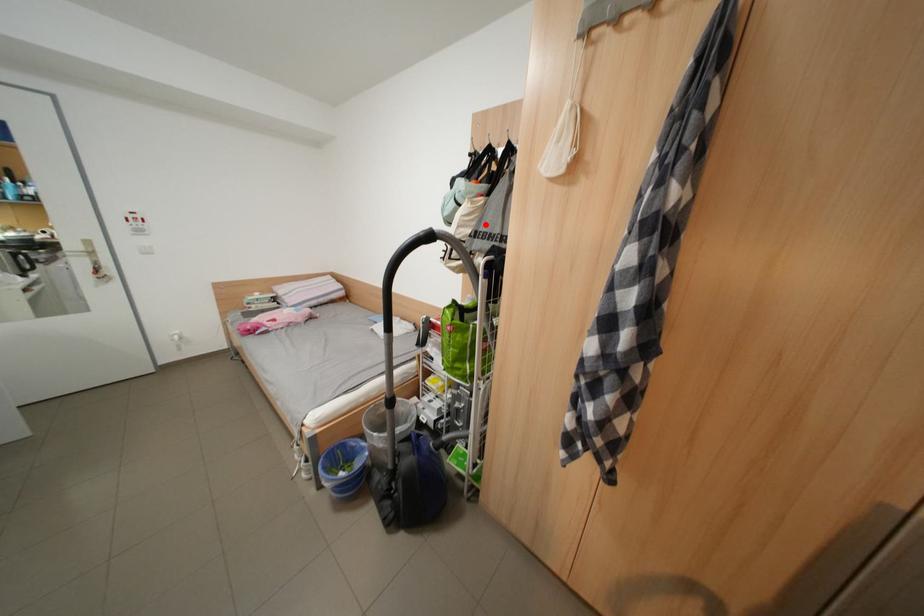
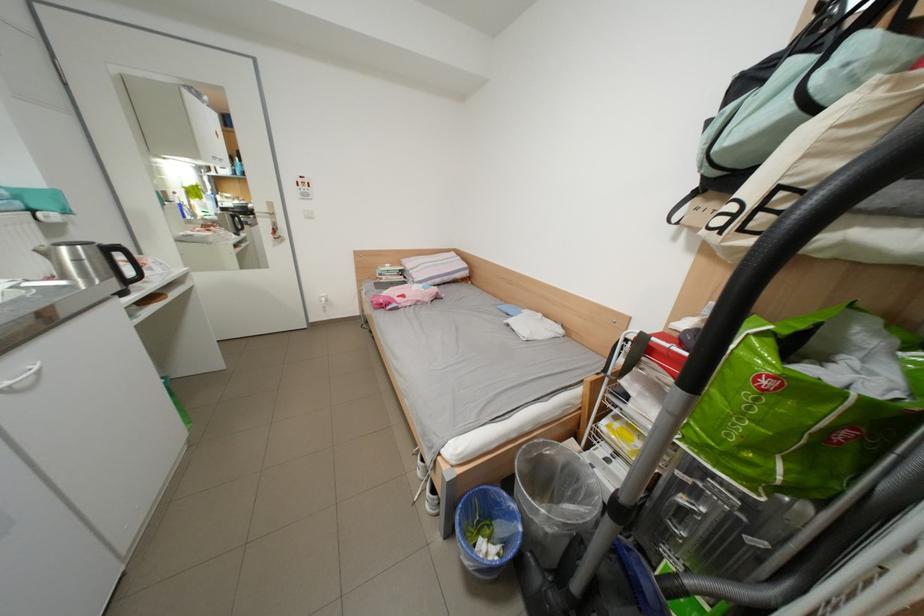
Question: I am providing you with two images of the same scene from different viewpoints. A red point is marked on the first image. Can you still see the location of the red point in image 2?

Choices:
 (A) Yes
 (B) No

Answer: (A)